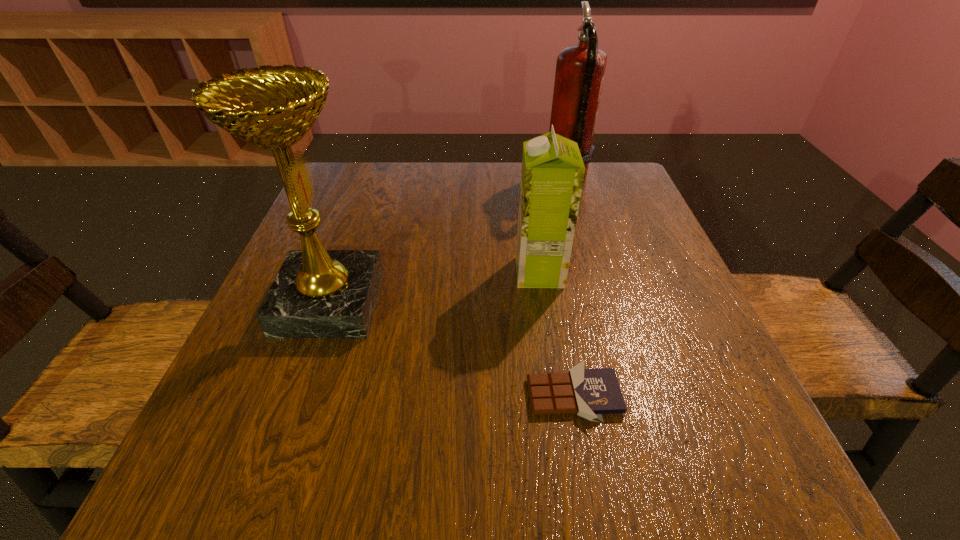
Identify the location of free spot between the chocolate bar and the second shortest object. (x=557, y=334).

In order to click on vacant space that is in between the fire extinguisher and the award in this screenshot , I will do `click(448, 241)`.

The height and width of the screenshot is (540, 960). Find the location of `empty location between the nearest object and the farthest object`. empty location between the nearest object and the farthest object is located at coordinates (570, 288).

This screenshot has height=540, width=960. What are the coordinates of `blank region between the chocolate bar and the farthest object` in the screenshot? It's located at (570, 288).

Find the location of a particular element. vacant space that's between the leftmost object and the soya milk is located at coordinates (434, 287).

You are a GUI agent. You are given a task and a screenshot of the screen. Output one action in this format:
    pyautogui.click(x=<x>, y=<y>)
    Task: Click on the free space between the third tallest object and the leftmost object
    
    Given the screenshot: What is the action you would take?
    pyautogui.click(x=434, y=287)

Where is `empty space that is in between the award and the second shortest object`? This screenshot has width=960, height=540. empty space that is in between the award and the second shortest object is located at coordinates (434, 287).

Locate an element on the screen. The width and height of the screenshot is (960, 540). the third closest object relative to the fire extinguisher is located at coordinates point(590,393).

Locate which object ranks in proximity to the farthest object. Please provide its 2D coordinates. Your answer should be formatted as a tuple, i.e. [(x, y)], where the tuple contains the x and y coordinates of a point satisfying the conditions above.

[(552, 174)]

At what (x,y) coordinates should I click in order to perform the action: click on blank space that satisfies the following two spatial constraints: 1. on the front-facing side of the award; 2. on the left side of the shortest object. Please return your answer as a coordinate pair (x, y). This screenshot has height=540, width=960. Looking at the image, I should click on tap(297, 395).